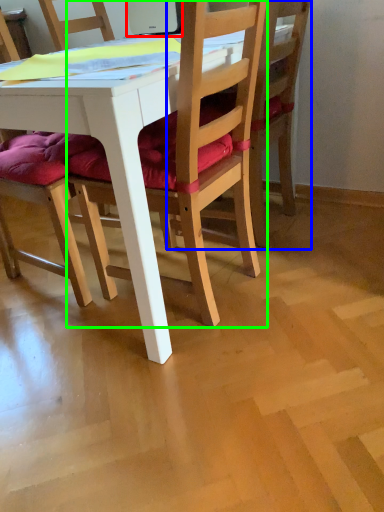
Question: Based on their relative distances, which object is farther from laptop (highlighted by a red box)? Choose from chair (highlighted by a blue box) and chair (highlighted by a green box).

Choices:
 (A) chair
 (B) chair

Answer: (B)